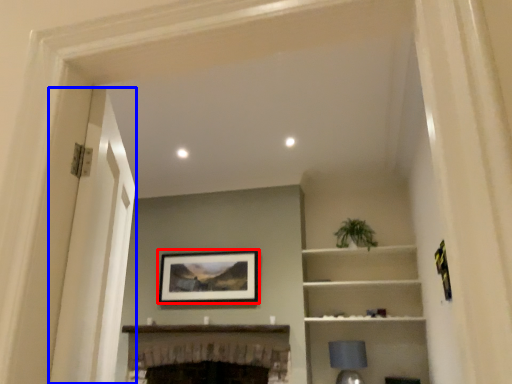
Question: Which object is further to the camera taking this photo, picture frame (highlighted by a red box) or glass door (highlighted by a blue box)?

Choices:
 (A) picture frame
 (B) glass door

Answer: (A)